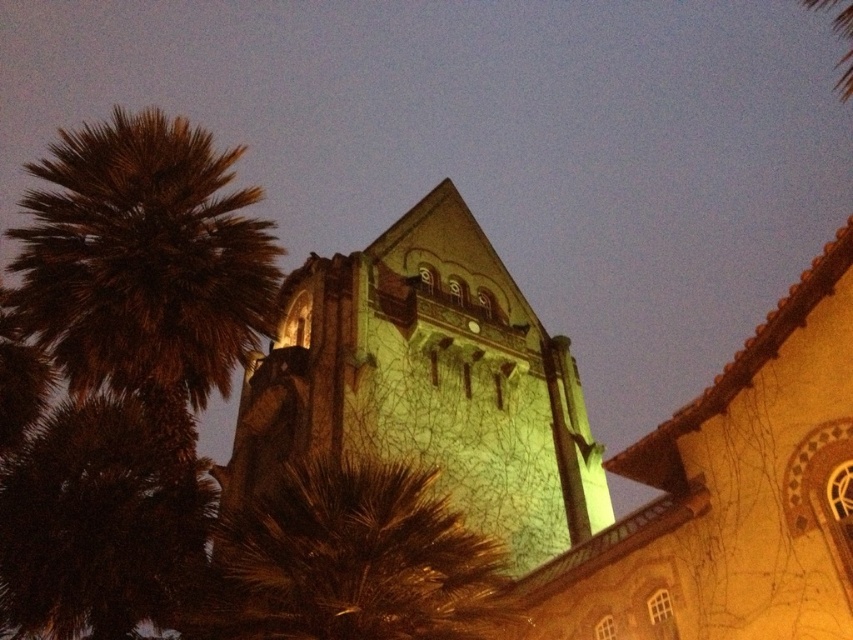
What do you see at coordinates (430, 381) in the screenshot? I see `green stone tower at center` at bounding box center [430, 381].

Looking at this image, is green stone tower at center above brown fuzzy palm tree at left?

No.

The image size is (853, 640). Describe the element at coordinates (430, 381) in the screenshot. I see `green stone tower at center` at that location.

The image size is (853, 640). I want to click on green stone tower at center, so click(x=430, y=381).